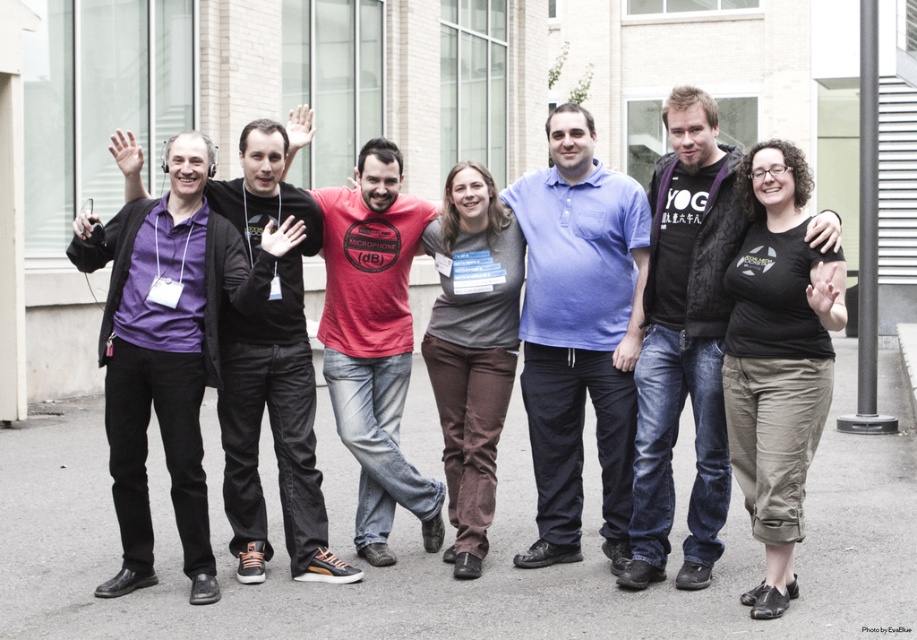
You are a photographer adjusting your camera settings to ensure all subjects are in focus. The purple matte shirt at left and the gray cotton shirt at center are two people in the group. Which of these two shirts is positioned closer to the camera?

The purple matte shirt at left is closer to the viewer than the gray cotton shirt at center, so the purple matte shirt at left is positioned closer to the camera.

You are a photographer adjusting the lighting for a group photo. You notice the blue cotton polo shirt at center and the black matte jacket at center. Which clothing item is positioned lower in the image?

The blue cotton polo shirt at center is below the black matte jacket at center, so it is positioned lower in the image.

You are standing in front of the modern building with the group. You need to locate the blue cotton polo shirt at center. Where exactly is it positioned relative to the other people in the group?

The blue cotton polo shirt at center is located at point (x=579, y=332). However, without a reference coordinate system, it is difficult to determine its exact position relative to the other people in the group.